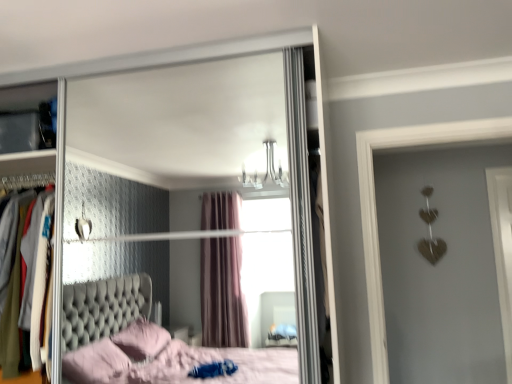
This screenshot has width=512, height=384. I want to click on clear glass mirror at upper center, so click(196, 125).

Describe the element at coordinates (196, 125) in the screenshot. I see `clear glass mirror at upper center` at that location.

What is the approximate height of clear glass mirror at upper center?

clear glass mirror at upper center is 5.37 feet tall.

This screenshot has width=512, height=384. I want to click on metallic silver dresser at left, so click(x=28, y=167).

This screenshot has height=384, width=512. Describe the element at coordinates (28, 167) in the screenshot. I see `metallic silver dresser at left` at that location.

Where is `clear glass mirror at upper center`? clear glass mirror at upper center is located at coordinates (196, 125).

In the scene shown: Can you confirm if metallic silver dresser at left is positioned to the right of clear glass mirror at upper center?

In fact, metallic silver dresser at left is to the left of clear glass mirror at upper center.

Which object is closer to the camera, metallic silver dresser at left or clear glass mirror at upper center?

clear glass mirror at upper center is more forward.

Is point (4, 98) closer to camera compared to point (292, 62)?

That is False.

From the image's perspective, would you say metallic silver dresser at left is shown under clear glass mirror at upper center?

Yes, from the image's perspective, metallic silver dresser at left is below clear glass mirror at upper center.

From a real-world perspective, is metallic silver dresser at left physically located above or below clear glass mirror at upper center?

Clearly, from a real-world perspective, metallic silver dresser at left is below clear glass mirror at upper center.

Which of these two, metallic silver dresser at left or clear glass mirror at upper center, is wider?

Wider between the two is clear glass mirror at upper center.

Can you confirm if metallic silver dresser at left is taller than clear glass mirror at upper center?

Incorrect, the height of metallic silver dresser at left is not larger of that of clear glass mirror at upper center.

Between metallic silver dresser at left and clear glass mirror at upper center, which one has smaller size?

Smaller between the two is metallic silver dresser at left.

Is metallic silver dresser at left completely or partially outside of clear glass mirror at upper center?

That's incorrect, metallic silver dresser at left is not completely outside clear glass mirror at upper center.

Is metallic silver dresser at left positioned far away from clear glass mirror at upper center?

Yes, metallic silver dresser at left and clear glass mirror at upper center are quite far apart.

Does metallic silver dresser at left turn towards clear glass mirror at upper center?

Yes, metallic silver dresser at left faces towards clear glass mirror at upper center.

Identify the location of mirror located above the metallic silver dresser at left (from the image's perspective). (196, 125).

Considering the positions of objects clear glass mirror at upper center and metallic silver dresser at left in the image provided, who is more to the left, clear glass mirror at upper center or metallic silver dresser at left?

metallic silver dresser at left.

Relative to metallic silver dresser at left, is clear glass mirror at upper center in front or behind?

Visually, clear glass mirror at upper center is located in front of metallic silver dresser at left.

Which is in front, point (187, 82) or point (4, 166)?

The point (187, 82) is in front.

From the picture: From the image's perspective, is clear glass mirror at upper center located above or below metallic silver dresser at left?

Based on their image positions, clear glass mirror at upper center is located above metallic silver dresser at left.

From a real-world perspective, who is located lower, clear glass mirror at upper center or metallic silver dresser at left?

metallic silver dresser at left, from a real-world perspective.

Which of these two, clear glass mirror at upper center or metallic silver dresser at left, is thinner?

→ metallic silver dresser at left is thinner.

Who is shorter, clear glass mirror at upper center or metallic silver dresser at left?

With less height is metallic silver dresser at left.

Looking at this image, considering the sizes of objects clear glass mirror at upper center and metallic silver dresser at left in the image provided, who is bigger, clear glass mirror at upper center or metallic silver dresser at left?

clear glass mirror at upper center is bigger.

Which is correct: clear glass mirror at upper center is inside metallic silver dresser at left, or outside of it?

clear glass mirror at upper center exists outside the volume of metallic silver dresser at left.

Is clear glass mirror at upper center positioned far away from metallic silver dresser at left?

Indeed, clear glass mirror at upper center is not near metallic silver dresser at left.

Could you tell me if clear glass mirror at upper center is turned towards metallic silver dresser at left?

Yes.

How much distance is there between clear glass mirror at upper center and metallic silver dresser at left?

clear glass mirror at upper center and metallic silver dresser at left are 1.31 meters apart from each other.

Find the location of a particular element. dresser below the clear glass mirror at upper center (from a real-world perspective) is located at coordinates (28, 167).

Image resolution: width=512 pixels, height=384 pixels. I want to click on dresser below the clear glass mirror at upper center (from the image's perspective), so tap(28, 167).

Image resolution: width=512 pixels, height=384 pixels. Find the location of `mirror located in front of the metallic silver dresser at left`. mirror located in front of the metallic silver dresser at left is located at coordinates (196, 125).